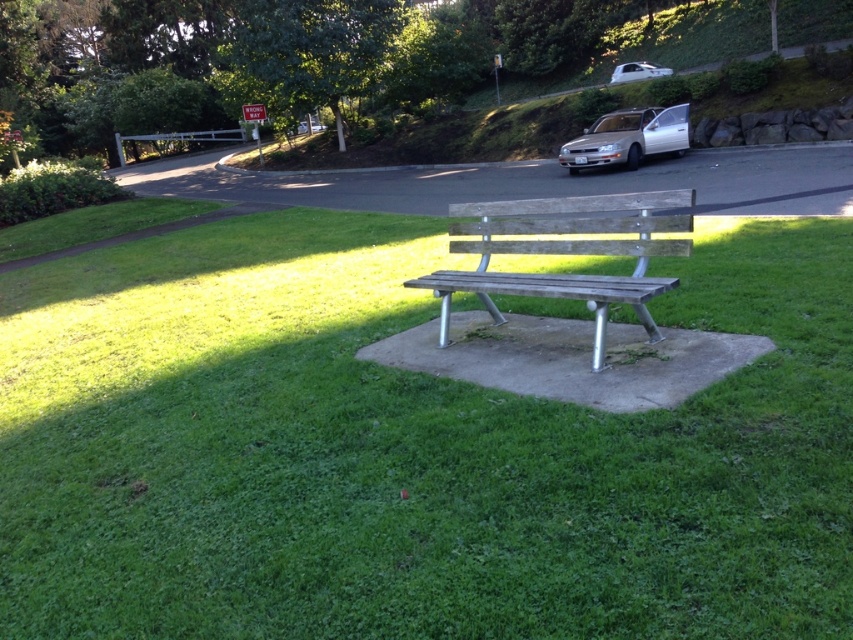
Question: Among these points, which one is farthest from the camera?

Choices:
 (A) (656, 108)
 (B) (143, 404)

Answer: (A)

Question: Does green grassy at center have a larger size compared to silver metallic sedan at upper right?

Choices:
 (A) no
 (B) yes

Answer: (B)

Question: Is green grassy at center to the right of weathered wood bench at center from the viewer's perspective?

Choices:
 (A) no
 (B) yes

Answer: (A)

Question: Based on their relative distances, which object is farther from the green grassy at center?

Choices:
 (A) weathered wood bench at center
 (B) silver metallic sedan at upper right

Answer: (B)

Question: From the image, what is the correct spatial relationship of green grassy at center in relation to silver metallic sedan at upper right?

Choices:
 (A) below
 (B) above

Answer: (A)

Question: Which point is farther to the camera?

Choices:
 (A) white glossy car at upper center
 (B) green grassy at center
 (C) weathered wood bench at center
 (D) silver metallic sedan at upper right

Answer: (A)